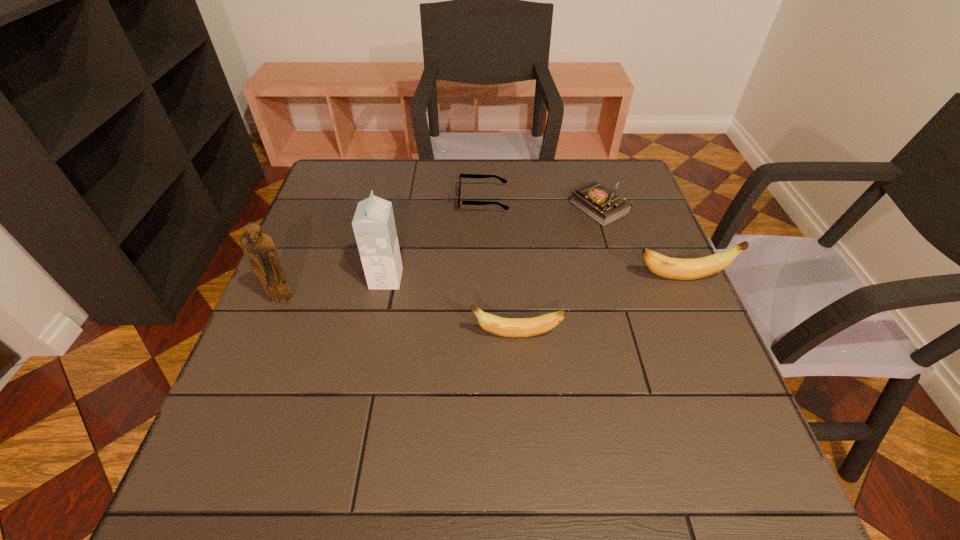
You are a GUI agent. You are given a task and a screenshot of the screen. Output one action in this format:
    pyautogui.click(x=<x>, y=<y>)
    Task: Click on the object that is at the left edge
    
    Given the screenshot: What is the action you would take?
    [x=259, y=246]

Where is `banana at the right edge`? The width and height of the screenshot is (960, 540). banana at the right edge is located at coordinates (674, 268).

The height and width of the screenshot is (540, 960). Identify the location of diary that is at the right edge. (602, 205).

This screenshot has width=960, height=540. Find the location of `object that is at the far right corner`. object that is at the far right corner is located at coordinates (602, 205).

The width and height of the screenshot is (960, 540). Find the location of `vacant space at the far edge`. vacant space at the far edge is located at coordinates (506, 204).

This screenshot has width=960, height=540. I want to click on free spot at the left edge of the desktop, so coord(331,248).

This screenshot has height=540, width=960. In order to click on vacant space at the right edge in this screenshot , I will do `click(640, 210)`.

I want to click on free space at the far left corner of the desktop, so click(x=319, y=195).

Where is `vacant space at the near left corner of the desktop`? This screenshot has width=960, height=540. vacant space at the near left corner of the desktop is located at coordinates (233, 409).

In order to click on vacant space at the far right corner in this screenshot , I will do `click(589, 166)`.